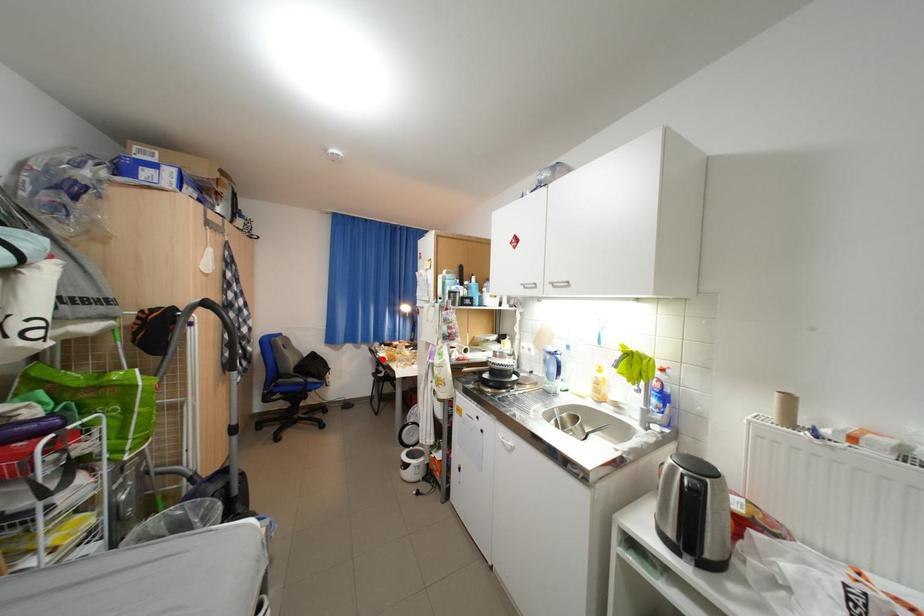
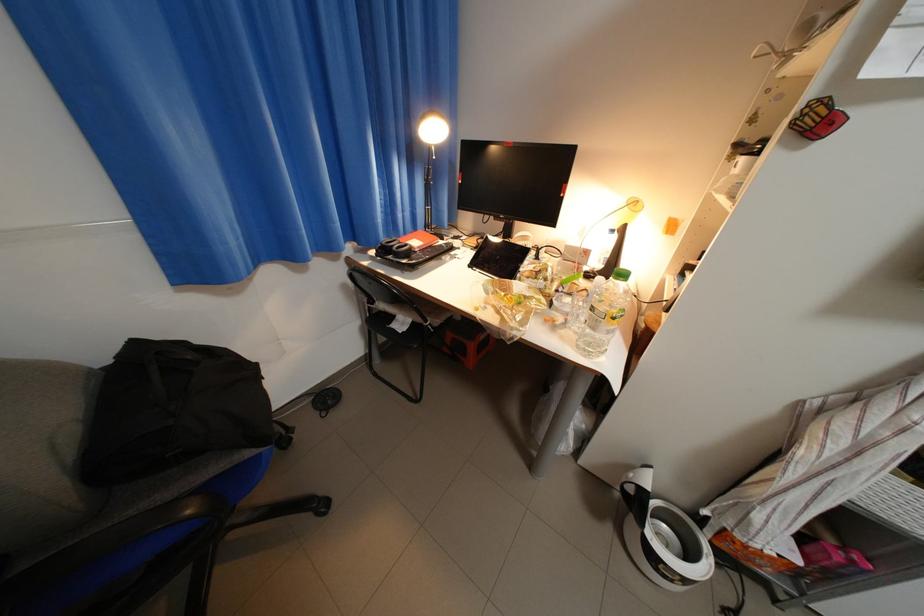
Question: A red point is marked in image1. In image2, is the corresponding 3D point closer to the camera or farther? Reply with the corresponding letter.

Choices:
 (A) The corresponding 3D point is closer.
 (B) The corresponding 3D point is farther.

Answer: (A)